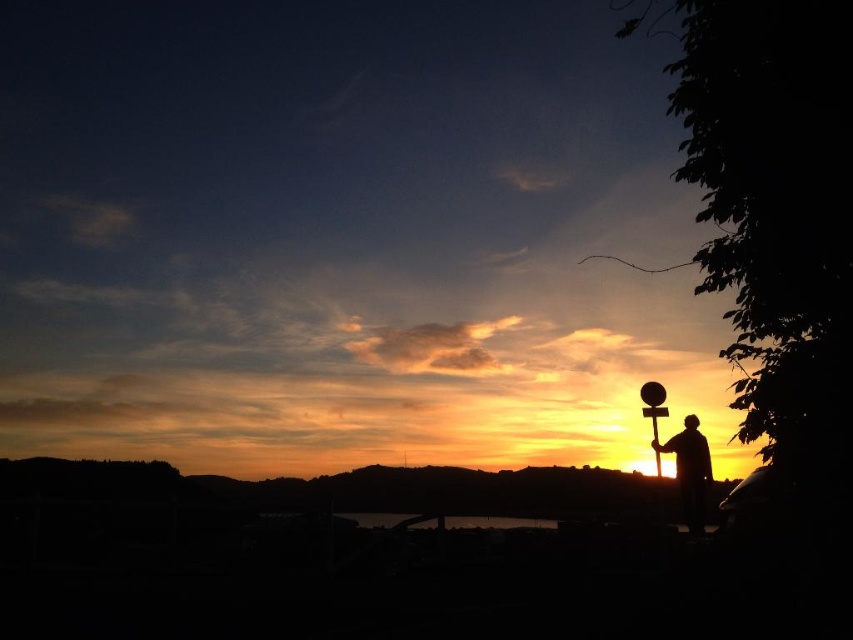
Between silhouette figure at right and dark reflective water at center, which one is positioned higher?

Positioned higher is silhouette figure at right.

Who is more forward, (x=666, y=445) or (x=479, y=528)?

Point (x=666, y=445) is in front.

Where is `silhouette figure at right`? This screenshot has width=853, height=640. silhouette figure at right is located at coordinates (689, 470).